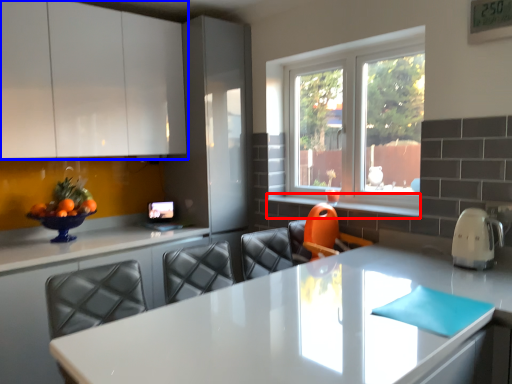
Question: Which of the following is the farthest to the observer, window sill (highlighted by a red box) or cabinetry (highlighted by a blue box)?

Choices:
 (A) window sill
 (B) cabinetry

Answer: (A)